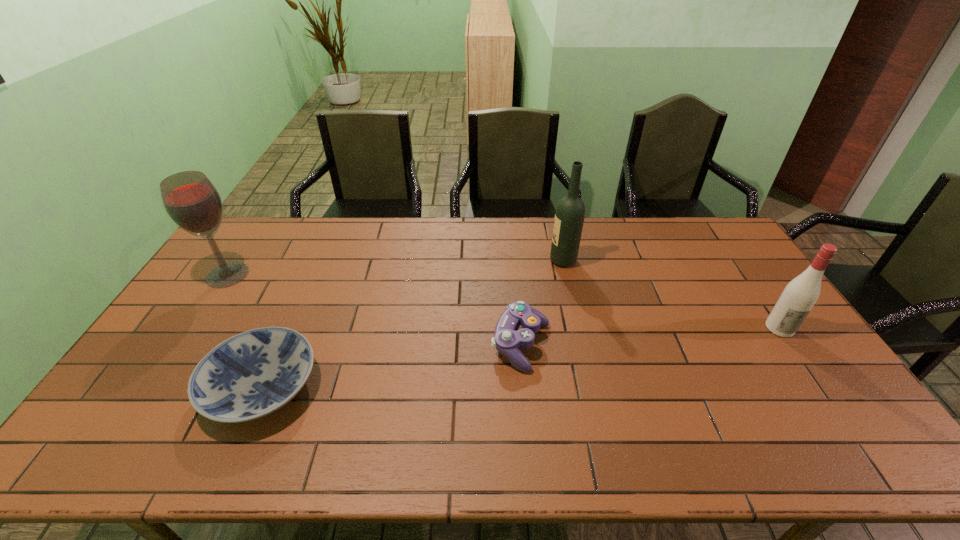
The height and width of the screenshot is (540, 960). In order to click on the fourth object from left to right in this screenshot , I will do `click(570, 212)`.

Identify the location of the leftmost object. (190, 199).

Image resolution: width=960 pixels, height=540 pixels. In order to click on the farther alcohol in this screenshot , I will do click(x=190, y=199).

Identify the location of the shorter alcohol. (800, 295).

Find the location of a particular element. the right alcohol is located at coordinates (800, 295).

Where is `the third object from left to right`? The width and height of the screenshot is (960, 540). the third object from left to right is located at coordinates (507, 340).

Where is `plate`? The width and height of the screenshot is (960, 540). plate is located at coordinates (253, 374).

Locate an element on the screen. the fourth object from right to left is located at coordinates (253, 374).

Identify the location of free space located 0.270m on the labeled side of the wine bottle. The height and width of the screenshot is (540, 960). (473, 261).

Locate an element on the screen. Image resolution: width=960 pixels, height=540 pixels. vacant space situated 0.220m on the labeled side of the wine bottle is located at coordinates (488, 261).